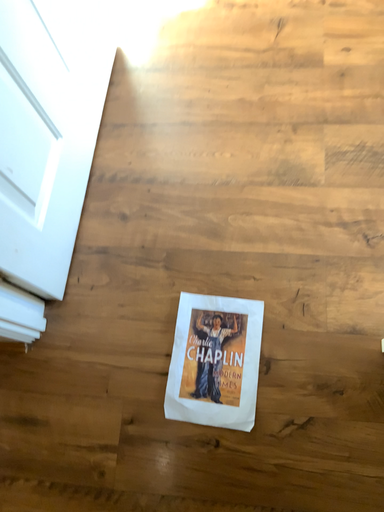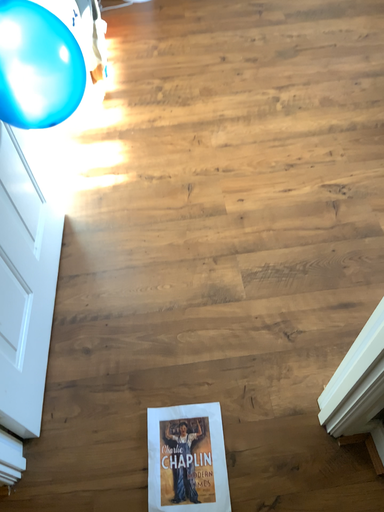
Question: How did the camera likely rotate when shooting the video?

Choices:
 (A) rotated downward
 (B) rotated upward

Answer: (B)